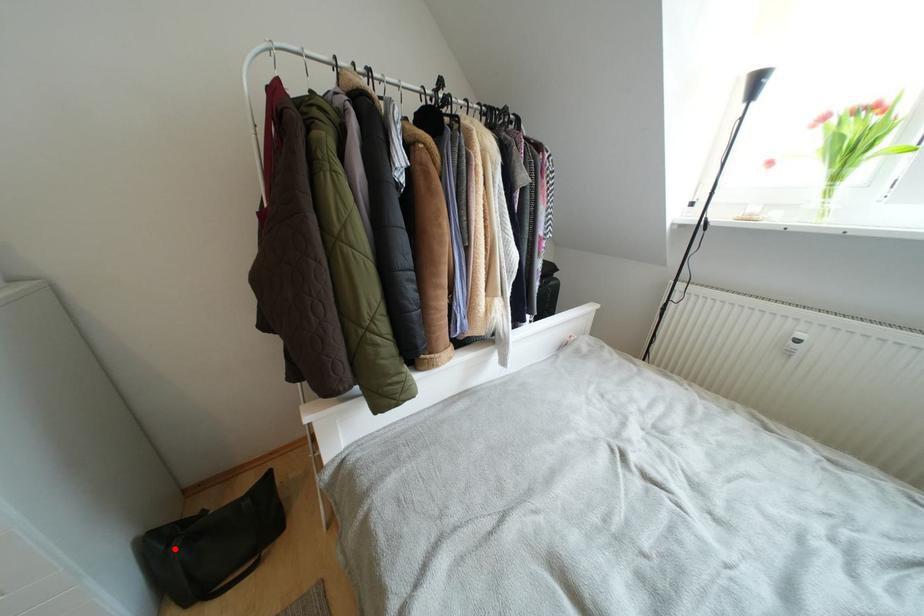
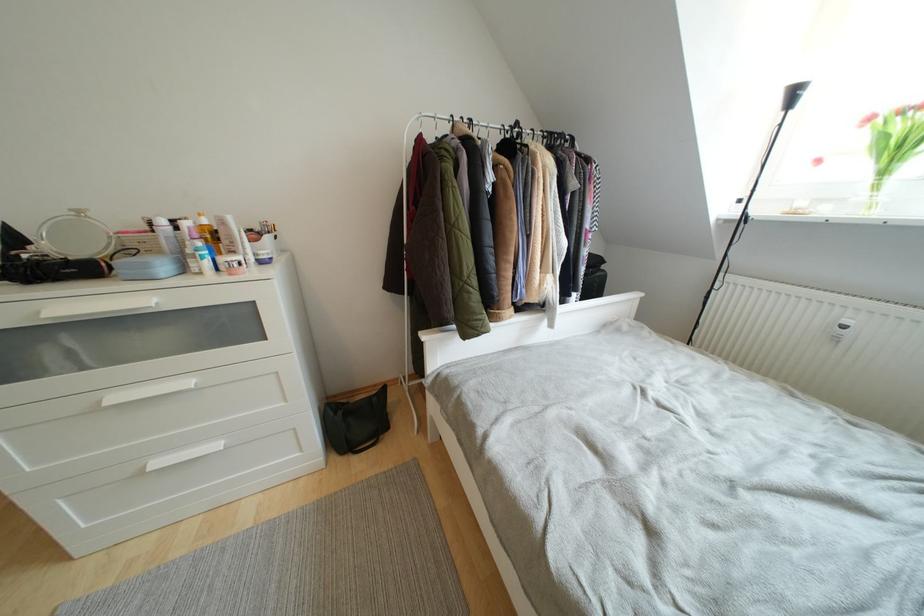
Locate, in the second image, the point that corresponds to the highlighted location in the first image.

(341, 416)